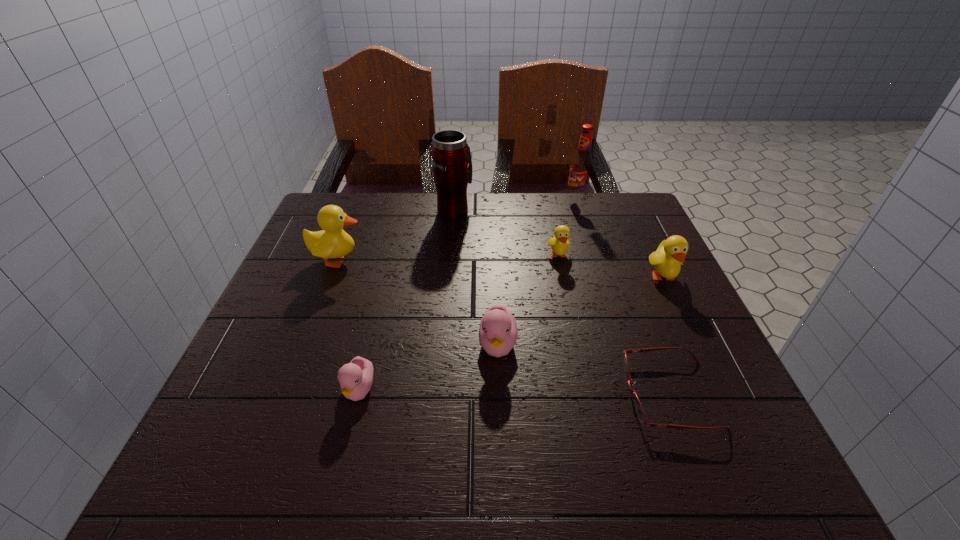
Where is `duckling that is the second closest to the red root beer`? The height and width of the screenshot is (540, 960). duckling that is the second closest to the red root beer is located at coordinates (667, 260).

At what (x,y) coordinates should I click in order to perform the action: click on yellow duckling that can be found as the closest to the third duckling from right to left. Please return your answer as a coordinate pair (x, y). This screenshot has height=540, width=960. Looking at the image, I should click on (559, 243).

Locate which yellow duckling ranks third in proximity to the fifth object from right to left. Please provide its 2D coordinates. Your answer should be formatted as a tuple, i.e. [(x, y)], where the tuple contains the x and y coordinates of a point satisfying the conditions above.

[(667, 260)]

In order to click on free region that satisfies the following two spatial constraints: 1. on the side with the handle of the root beer; 2. on the right side of the thermos bottle in this screenshot , I will do `click(455, 200)`.

The image size is (960, 540). What are the coordinates of `blank area in the image that satisfies the following two spatial constraints: 1. on the front-facing side of the second smallest yellow duckling; 2. on the lenses of the shortest object` in the screenshot? It's located at (719, 394).